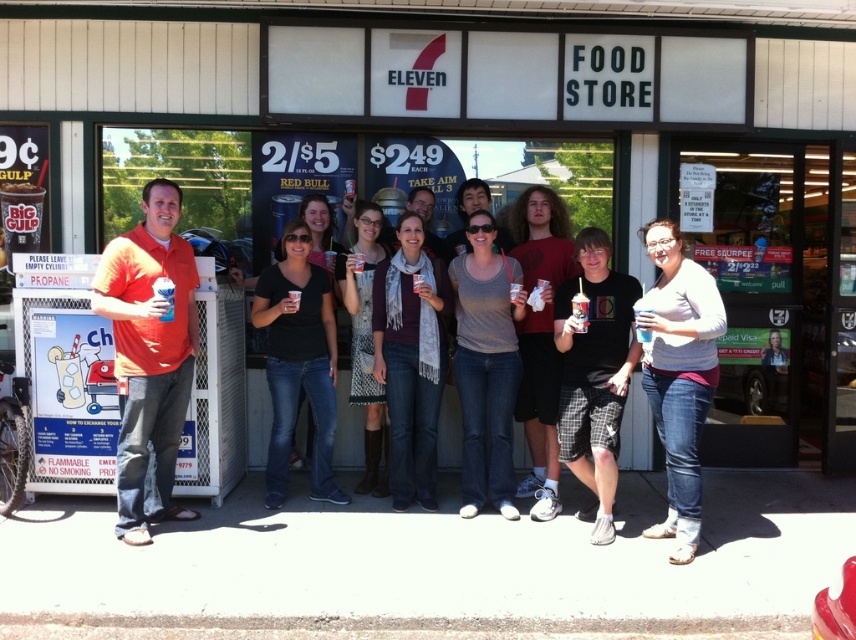
You are standing in front of the 7Eleven store and see a group of people posing for a photo. Which person is wearing the matte orange shirt at left?

The matte orange shirt at left is located at point (149, 356), so the person wearing it is on the left side of the group near the coordinates mentioned.

You are a photographer trying to capture a group photo of the matte orange shirt at left and the gray scarf at center. You want to ensure both are visible in the frame. Based on their positions, which object should you focus on first to ensure both are in the shot?

The matte orange shirt at left is wider than the gray scarf at center, so focusing on the matte orange shirt at left first would help ensure both are in the frame since it takes up more space.